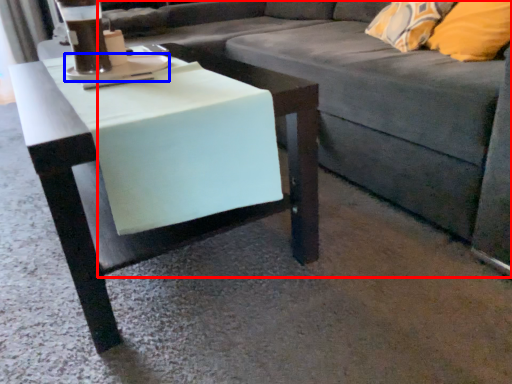
Question: Which object is closer to the camera taking this photo, studio couch (highlighted by a red box) or saucer (highlighted by a blue box)?

Choices:
 (A) studio couch
 (B) saucer

Answer: (A)